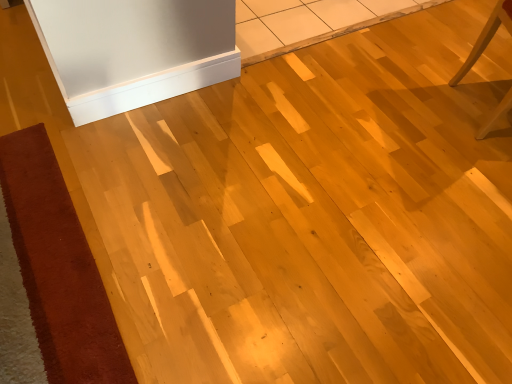
Identify the location of vacant area situated below light wood chair at right (from a real-world perspective). The height and width of the screenshot is (384, 512). (483, 108).